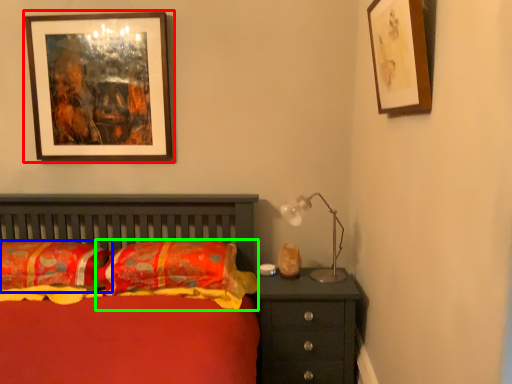
Question: Estimate the real-world distances between objects in this image. Which object is closer to picture frame (highlighted by a red box), pillow (highlighted by a blue box) or pillow (highlighted by a green box)?

Choices:
 (A) pillow
 (B) pillow

Answer: (A)